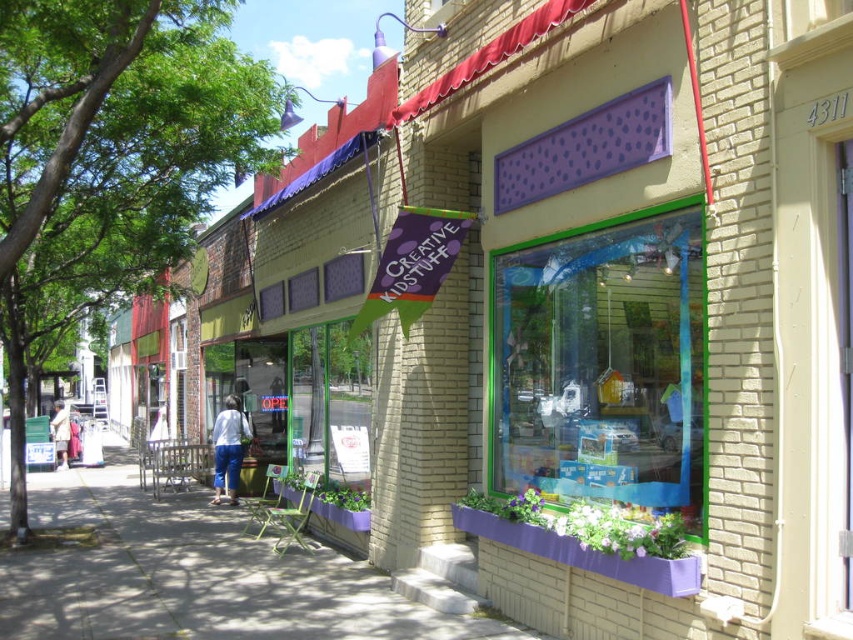
Who is higher up, smooth concrete sidewalk at lower left or denim pants at center?

denim pants at center is above.

How distant is smooth concrete sidewalk at lower left from denim pants at center?

smooth concrete sidewalk at lower left is 6.80 feet from denim pants at center.

Who is more forward, (49,605) or (230,499)?

Positioned in front is point (49,605).

Where is `smooth concrete sidewalk at lower left`? This screenshot has height=640, width=853. smooth concrete sidewalk at lower left is located at coordinates (194, 573).

Locate an element on the screen. This screenshot has height=640, width=853. green leafy tree at left is located at coordinates (109, 157).

In the scene shown: Is green leafy tree at left positioned in front of smooth concrete sidewalk at lower left?

Yes.

Is point (119, 292) closer to viewer compared to point (62, 509)?

No, (119, 292) is further to viewer.

The width and height of the screenshot is (853, 640). I want to click on green leafy tree at left, so click(x=109, y=157).

Describe the element at coordinates (194, 573) in the screenshot. I see `smooth concrete sidewalk at lower left` at that location.

Is point (28, 609) positioned before point (62, 456)?

That is True.

Where is `smooth concrete sidewalk at lower left`? The image size is (853, 640). smooth concrete sidewalk at lower left is located at coordinates (194, 573).